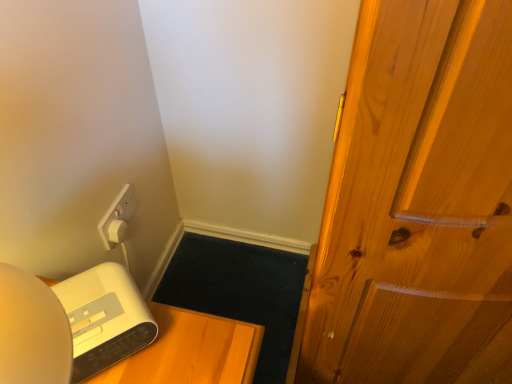
Question: Looking at their shapes, would you say white plastic alarm clock at lower left is wider or thinner than white matte speaker at lower left?

Choices:
 (A) wide
 (B) thin

Answer: (B)

Question: Which is correct: white plastic alarm clock at lower left is inside white matte speaker at lower left, or outside of it?

Choices:
 (A) inside
 (B) outside

Answer: (B)

Question: From the image's perspective, is white plastic alarm clock at lower left above or below white matte speaker at lower left?

Choices:
 (A) below
 (B) above

Answer: (B)

Question: Considering their positions, is white matte speaker at lower left located in front of or behind white plastic alarm clock at lower left?

Choices:
 (A) behind
 (B) front

Answer: (A)

Question: Based on their sizes in the image, would you say white matte speaker at lower left is bigger or smaller than white plastic alarm clock at lower left?

Choices:
 (A) small
 (B) big

Answer: (B)

Question: Is white matte speaker at lower left inside the boundaries of white plastic alarm clock at lower left, or outside?

Choices:
 (A) inside
 (B) outside

Answer: (B)

Question: Is white matte speaker at lower left to the left or to the right of white plastic alarm clock at lower left in the image?

Choices:
 (A) left
 (B) right

Answer: (B)